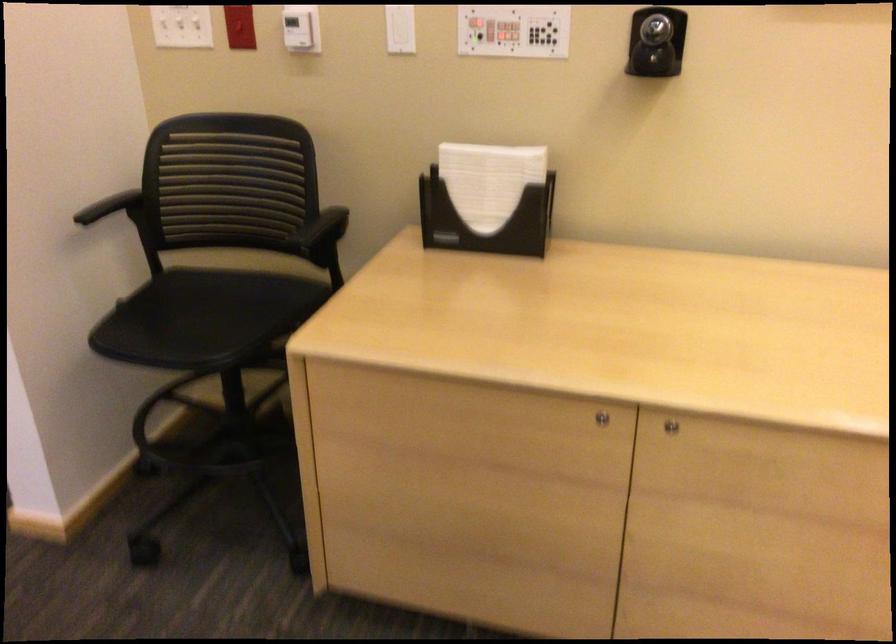
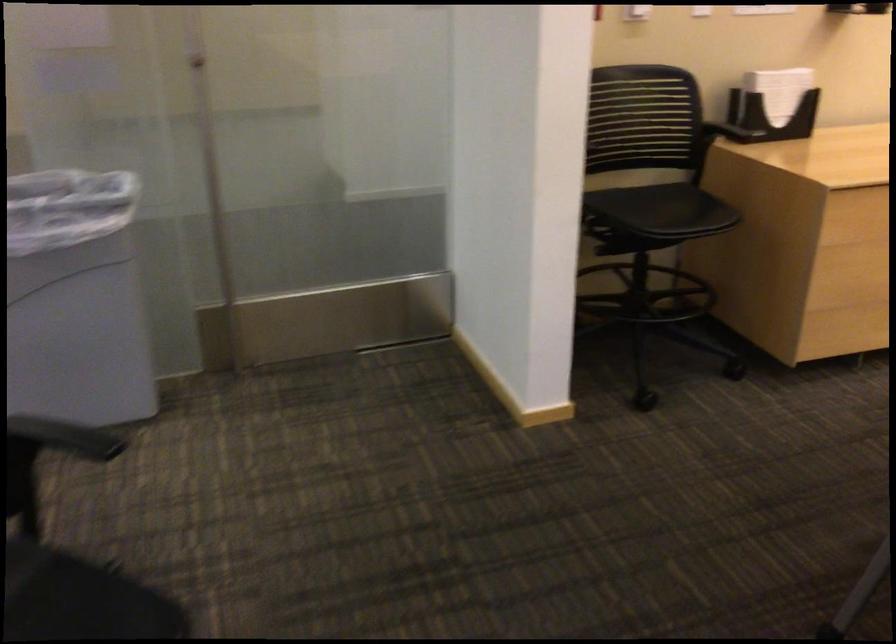
Question: Which direction would the cameraman need to move to produce the second image? Reply with the corresponding letter.

Choices:
 (A) Left
 (B) Right
 (C) Forward
 (D) Backward

Answer: (A)